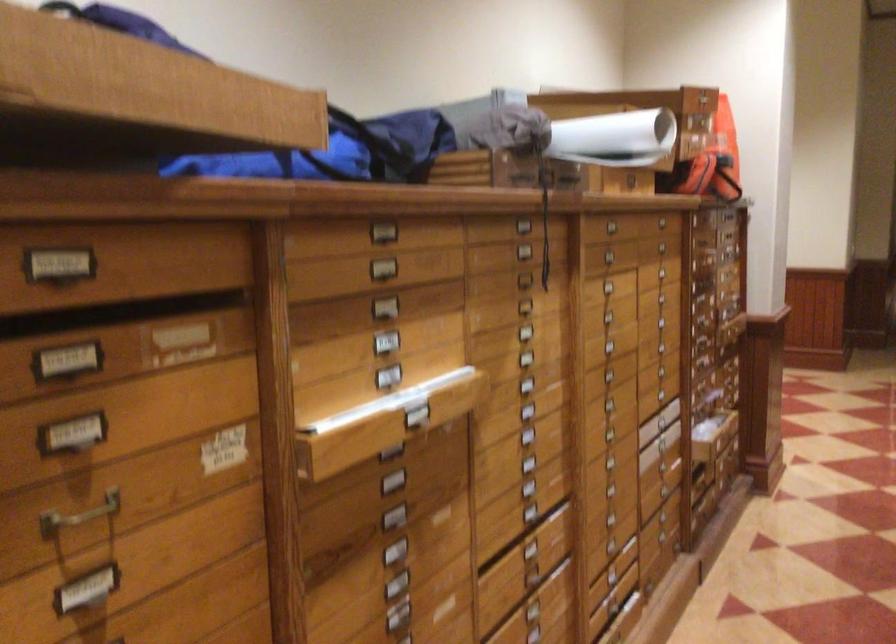
Find where to unroll the rolled white paper. Please return your answer as a coordinate pair (x, y).

(615, 138)